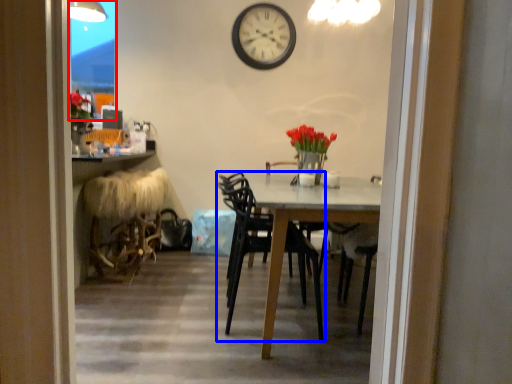
Question: Which of the following is the closest to the observer, glass door (highlighted by a red box) or chair (highlighted by a blue box)?

Choices:
 (A) glass door
 (B) chair

Answer: (B)